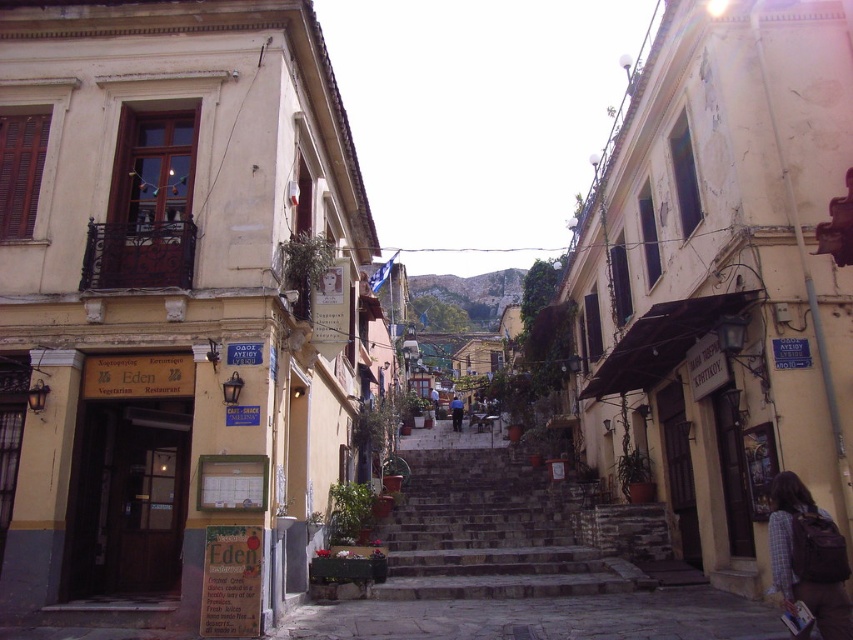
Question: Which point is farther to the camera?

Choices:
 (A) (461, 413)
 (B) (837, 595)

Answer: (A)

Question: Which point is farther from the camera taking this photo?

Choices:
 (A) (457, 588)
 (B) (457, 413)

Answer: (B)

Question: Is stone steps at center positioned in front of brown fabric backpack at lower right?

Choices:
 (A) no
 (B) yes

Answer: (A)

Question: Does brown fabric backpack at lower right appear on the right side of blue jeans at center?

Choices:
 (A) yes
 (B) no

Answer: (A)

Question: Does stone steps at center appear on the left side of brown fabric backpack at lower right?

Choices:
 (A) no
 (B) yes

Answer: (B)

Question: Which of the following is the farthest from the observer?

Choices:
 (A) (444, 554)
 (B) (805, 486)
 (C) (457, 413)

Answer: (C)